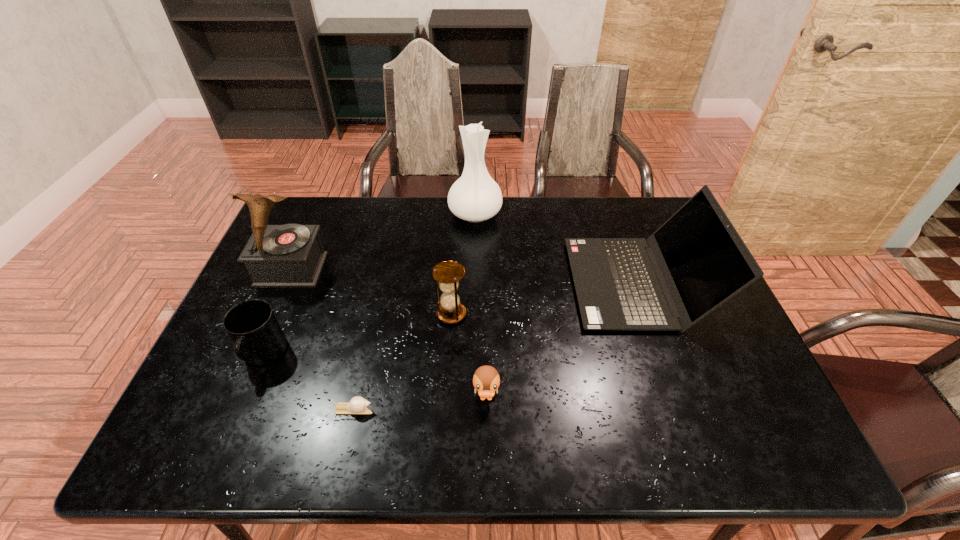
The width and height of the screenshot is (960, 540). Find the location of `object that is at the right edge`. object that is at the right edge is located at coordinates (696, 261).

I want to click on vacant point at the far edge, so click(560, 198).

Locate an element on the screen. free space at the near edge is located at coordinates (399, 421).

In the image, there is a desktop. Where is `blank space at the right edge`? This screenshot has height=540, width=960. blank space at the right edge is located at coordinates (734, 384).

What are the coordinates of `free space at the far left corner` in the screenshot? It's located at (323, 221).

At what (x,y) coordinates should I click in order to perform the action: click on free space at the far right corner of the desktop. Please return your answer as a coordinate pair (x, y). The height and width of the screenshot is (540, 960). Looking at the image, I should click on (657, 217).

The width and height of the screenshot is (960, 540). I want to click on free region at the near right corner of the desktop, so click(725, 427).

You are a GUI agent. You are given a task and a screenshot of the screen. Output one action in this format:
    pyautogui.click(x=<x>, y=<y>)
    Task: Click on the vacant area that lies between the farthest object and the hourglass
    
    Given the screenshot: What is the action you would take?
    464,264

Locate an element on the screen. This screenshot has height=540, width=960. vacant area that lies between the escargot and the mug is located at coordinates (308, 382).

Where is `free space that is in between the third shortest object and the duck`? free space that is in between the third shortest object and the duck is located at coordinates (375, 376).